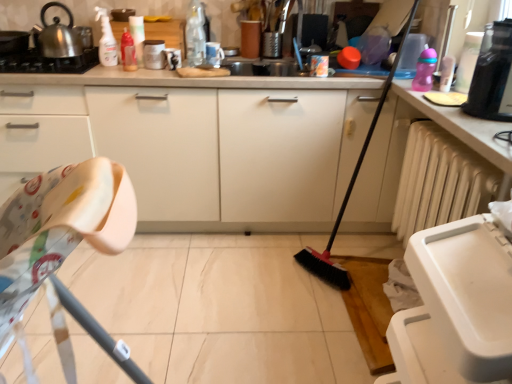
Question: From a real-world perspective, is translucent plastic bottle at upper center, which is counted as the 3th bottle, starting from the right, below matte white mug at upper center, positioned as the second appliance in bottom-to-top order?

Choices:
 (A) no
 (B) yes

Answer: (A)

Question: Is translucent plastic bottle at upper center, which is counted as the 1th bottle, starting from the left, wider than matte white mug at upper center, which is the second appliance in left-to-right order?

Choices:
 (A) yes
 (B) no

Answer: (B)

Question: Is translucent plastic bottle at upper center, which is counted as the 1th bottle, starting from the left, located outside matte white mug at upper center, the third appliance in the front-to-back sequence?

Choices:
 (A) yes
 (B) no

Answer: (A)

Question: Does translucent plastic bottle at upper center, which is counted as the 1th bottle, starting from the left, turn towards matte white mug at upper center, arranged as the second appliance when viewed from the top?

Choices:
 (A) no
 (B) yes

Answer: (A)

Question: Can you confirm if translucent plastic bottle at upper center, which is counted as the 3th bottle, starting from the right, is bigger than matte white mug at upper center, the third appliance in the front-to-back sequence?

Choices:
 (A) no
 (B) yes

Answer: (A)

Question: Considering their positions, is white plastic folding chair at left located in front of or behind metallic stainless steel kettle at upper left?

Choices:
 (A) behind
 (B) front

Answer: (B)

Question: Looking at their shapes, would you say white plastic folding chair at left is wider or thinner than metallic stainless steel kettle at upper left?

Choices:
 (A) thin
 (B) wide

Answer: (A)

Question: Considering the relative positions of white plastic folding chair at left and metallic stainless steel kettle at upper left in the image provided, is white plastic folding chair at left to the left or to the right of metallic stainless steel kettle at upper left?

Choices:
 (A) left
 (B) right

Answer: (B)

Question: In terms of size, does white plastic folding chair at left appear bigger or smaller than metallic stainless steel kettle at upper left?

Choices:
 (A) big
 (B) small

Answer: (A)

Question: From the image's perspective, is matte white mug at upper center, acting as the 1th appliance starting from the back, located above or below metallic stainless steel kettle at upper left, the 3th appliance viewed from the right?

Choices:
 (A) below
 (B) above

Answer: (A)

Question: Is point (157, 67) closer or farther from the camera than point (7, 31)?

Choices:
 (A) closer
 (B) farther

Answer: (A)

Question: Is matte white mug at upper center, acting as the 1th appliance starting from the back, spatially inside metallic stainless steel kettle at upper left, the 3th appliance viewed from the right, or outside of it?

Choices:
 (A) inside
 (B) outside

Answer: (B)

Question: From a real-world perspective, relative to metallic stainless steel kettle at upper left, marked as the 1th appliance in a left-to-right arrangement, is matte white mug at upper center, the third appliance in the front-to-back sequence, vertically above or below?

Choices:
 (A) below
 (B) above

Answer: (A)

Question: Visually, is white plastic radiator at lower right positioned to the left or to the right of white plastic trash can at lower right, the 3th appliance in the left-to-right sequence?

Choices:
 (A) left
 (B) right

Answer: (B)

Question: Considering the positions of point (454, 160) and point (445, 327), is point (454, 160) closer or farther from the camera than point (445, 327)?

Choices:
 (A) farther
 (B) closer

Answer: (A)